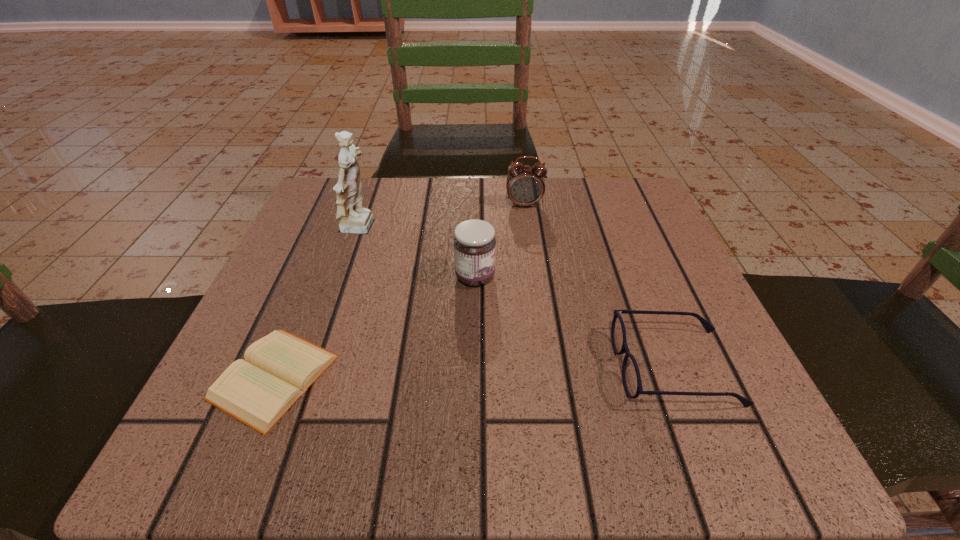
Find the location of a particular element. The height and width of the screenshot is (540, 960). vacant space at the far left corner of the desktop is located at coordinates 377,206.

This screenshot has height=540, width=960. I want to click on vacant space at the near left corner, so click(270, 458).

You are a GUI agent. You are given a task and a screenshot of the screen. Output one action in this format:
    pyautogui.click(x=<x>, y=<y>)
    Task: Click on the free spot at the far right corner of the desktop
    The image size is (960, 540).
    Given the screenshot: What is the action you would take?
    pos(656,220)

The width and height of the screenshot is (960, 540). In order to click on vacant area that lies between the shortest object and the spectacles in this screenshot , I will do `click(474, 372)`.

Identify the location of vacant area that lies between the rightmost object and the tallest object. (517, 298).

I want to click on unoccupied position between the diary and the jam, so click(x=374, y=327).

Where is `free area in between the fourth nearest object and the spectacles`? This screenshot has height=540, width=960. free area in between the fourth nearest object and the spectacles is located at coordinates (517, 298).

Image resolution: width=960 pixels, height=540 pixels. What are the coordinates of `unoccupied area between the jam and the diary` in the screenshot? It's located at (374, 327).

Locate an element on the screen. This screenshot has width=960, height=540. free spot between the spectacles and the farthest object is located at coordinates (599, 286).

Where is `unoccupied position between the rightmost object and the alarm clock`? The width and height of the screenshot is (960, 540). unoccupied position between the rightmost object and the alarm clock is located at coordinates (599, 286).